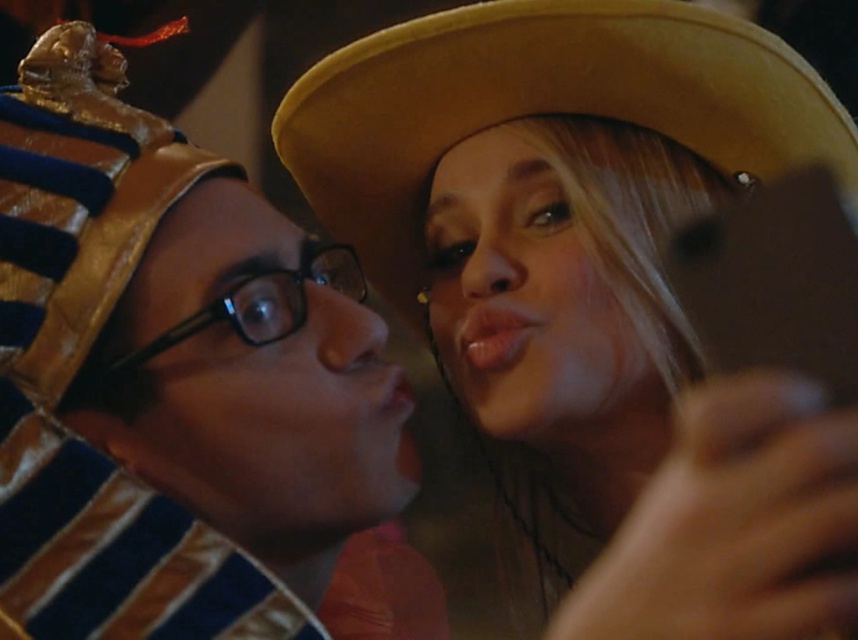
Image resolution: width=858 pixels, height=640 pixels. What are the coordinates of `light brown felt cowboy hat at upper center` in the screenshot? It's located at (539, 106).

The height and width of the screenshot is (640, 858). In order to click on light brown felt cowboy hat at upper center in this screenshot , I will do `click(539, 106)`.